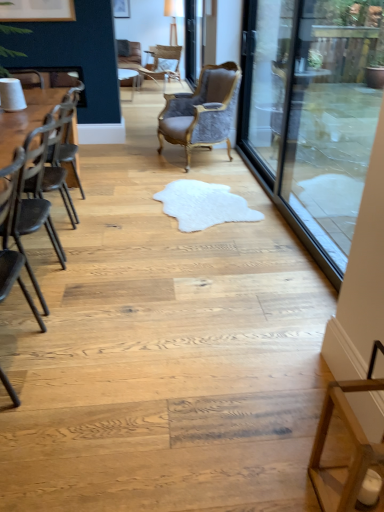
Question: Is point (18, 266) positioned closer to the camera than point (193, 15)?

Choices:
 (A) closer
 (B) farther

Answer: (A)

Question: Considering the positions of black metal chair at left, the 4th chair viewed from the back, and clear glass screen door at upper center, which appears as the 2th screen door when viewed from the right, in the image, is black metal chair at left, the 4th chair viewed from the back, wider or thinner than clear glass screen door at upper center, which appears as the 2th screen door when viewed from the right,?

Choices:
 (A) wide
 (B) thin

Answer: (A)

Question: Which object is the farthest from the wooden table at left?

Choices:
 (A) velvet grey chair at center, marked as the 2th chair in a top-to-bottom arrangement
 (B) black metal chair at left, the 4th chair viewed from the back
 (C) white fluffy rug at center
 (D) light brown woven chair at upper center, the fourth chair when ordered from front to back
 (E) matte white picture frame at upper left

Answer: (E)

Question: Which object is positioned closest to the dark brown wood chair at left, the third chair viewed from the top?

Choices:
 (A) transparent glass door at right
 (B) transparent glass screen door at right, which appears as the 1th screen door when ordered from the bottom
 (C) white fluffy rug at center
 (D) light brown woven chair at upper center, which is counted as the first chair, starting from the back
 (E) clear glass screen door at upper center, which is the 1th screen door in top-to-bottom order

Answer: (C)